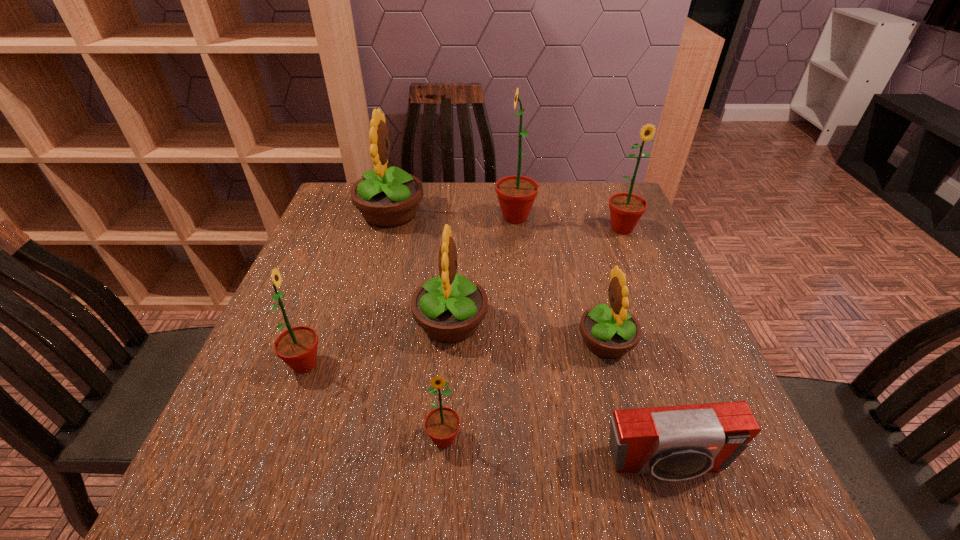
Select which yellow sunflower is the closest to the leftmost yellow sunflower. Please provide its 2D coordinates. Your answer should be formatted as a tuple, i.e. [(x, y)], where the tuple contains the x and y coordinates of a point satisfying the conditions above.

[(449, 307)]

You are a GUI agent. You are given a task and a screenshot of the screen. Output one action in this format:
    pyautogui.click(x=<x>, y=<y>)
    Task: Click on the yellow sunflower that is the closest one to the third green sunflower from left to right
    
    Given the screenshot: What is the action you would take?
    pyautogui.click(x=386, y=198)